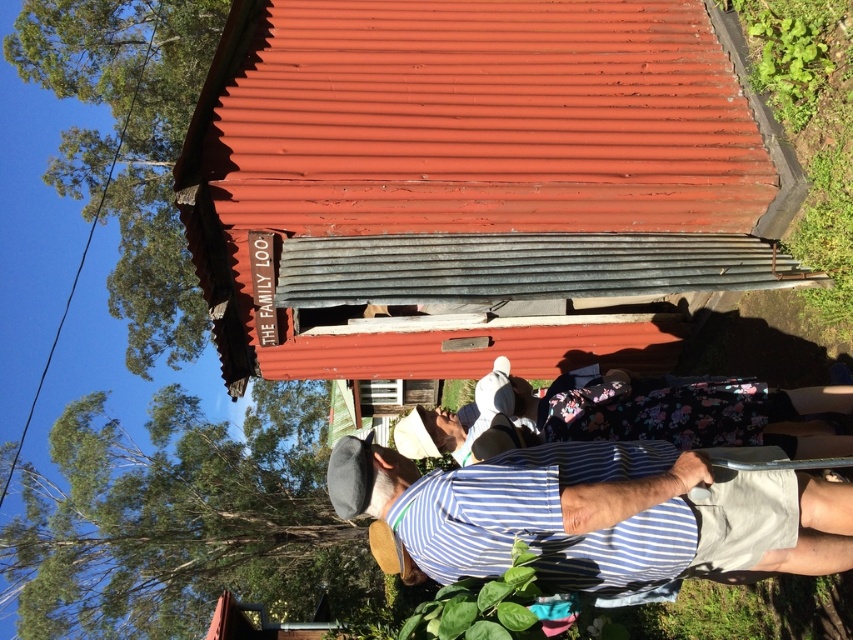
You are standing in the rustic outdoor scene and want to see the person wearing the blue striped shirt at lower center clearly. Since the rusty corrugated metal hut at center is in the way, which direction should you move to get a better view?

To see the blue striped shirt at lower center clearly, you should move to the side of the rusty corrugated metal hut at center, as the blue striped shirt at lower center is behind it and might be obstructed from your current viewpoint.